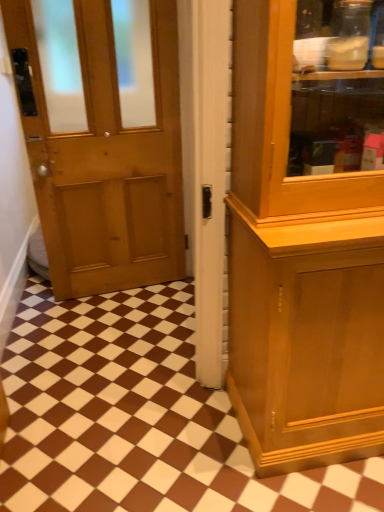
From the picture: Measure the distance between brown glossy tile at center and camera.

brown glossy tile at center is 4.18 feet from camera.

This screenshot has height=512, width=384. What are the coordinates of `brown glossy tile at center` in the screenshot? It's located at (137, 417).

What do you see at coordinates (137, 417) in the screenshot? I see `brown glossy tile at center` at bounding box center [137, 417].

In order to face matte wood door at center, should I rotate leftwards or rightwards?

Rotate left and turn 14.282 degrees.

Image resolution: width=384 pixels, height=512 pixels. What do you see at coordinates (101, 139) in the screenshot?
I see `matte wood door at center` at bounding box center [101, 139].

Measure the distance between matte wood door at center and camera.

matte wood door at center is 6.12 feet away from camera.

Where is `matte wood door at center`? matte wood door at center is located at coordinates (101, 139).

Find the location of `brown glossy tile at center`. brown glossy tile at center is located at coordinates (137, 417).

Looking at this image, between brown glossy tile at center and matte wood door at center, which one appears on the left side from the viewer's perspective?

matte wood door at center is more to the left.

Between brown glossy tile at center and matte wood door at center, which one is positioned in front?

matte wood door at center is in front.

Is point (103, 377) closer or farther from the camera than point (121, 204)?

Point (103, 377) is positioned closer to the camera compared to point (121, 204).

From the image's perspective, does brown glossy tile at center appear lower than matte wood door at center?

Correct, brown glossy tile at center appears lower than matte wood door at center in the image.

From a real-world perspective, does brown glossy tile at center stand above matte wood door at center?

Incorrect, from a real-world perspective, brown glossy tile at center is lower than matte wood door at center.

Which of these two, brown glossy tile at center or matte wood door at center, is thinner?

matte wood door at center is thinner.

From their relative heights in the image, would you say brown glossy tile at center is taller or shorter than matte wood door at center?

Considering their sizes, brown glossy tile at center has less height than matte wood door at center.

Considering the relative sizes of brown glossy tile at center and matte wood door at center in the image provided, is brown glossy tile at center bigger than matte wood door at center?

Yes, brown glossy tile at center is bigger than matte wood door at center.

Is matte wood door at center inside brown glossy tile at center?

That's incorrect, matte wood door at center is not inside brown glossy tile at center.

Are brown glossy tile at center and matte wood door at center located far from each other?

brown glossy tile at center is near matte wood door at center, not far away.

Is brown glossy tile at center looking in the opposite direction of matte wood door at center?

No, brown glossy tile at center is not facing away from matte wood door at center.

How different are the orientations of brown glossy tile at center and matte wood door at center in degrees?

They differ by 0.345 degrees in their facing directions.

This screenshot has width=384, height=512. What are the coordinates of `door on the left of brown glossy tile at center` in the screenshot? It's located at (101, 139).

Consider the image. Which object is positioned more to the right, matte wood door at center or brown glossy tile at center?

A: brown glossy tile at center is more to the right.

Is matte wood door at center closer to the viewer compared to brown glossy tile at center?

Yes, the depth of matte wood door at center is less than that of brown glossy tile at center.

Is point (109, 144) farther from camera compared to point (4, 505)?

Yes, point (109, 144) is farther from viewer.

From the image's perspective, does matte wood door at center appear higher than brown glossy tile at center?

Yes.

From a real-world perspective, is matte wood door at center positioned above or below brown glossy tile at center?

matte wood door at center is above brown glossy tile at center.

Between matte wood door at center and brown glossy tile at center, which one has larger width?

brown glossy tile at center.

Between matte wood door at center and brown glossy tile at center, which one has more height?

With more height is matte wood door at center.

Is matte wood door at center bigger or smaller than brown glossy tile at center?

In the image, matte wood door at center appears to be smaller than brown glossy tile at center.

Is matte wood door at center not inside brown glossy tile at center?

That's correct, matte wood door at center is outside of brown glossy tile at center.

Are matte wood door at center and brown glossy tile at center far apart?

Actually, matte wood door at center and brown glossy tile at center are a little close together.

In the scene shown: Is matte wood door at center looking in the opposite direction of brown glossy tile at center?

Absolutely, matte wood door at center is directed away from brown glossy tile at center.

What's the angular difference between matte wood door at center and brown glossy tile at center's facing directions?

The angle between the facing direction of matte wood door at center and the facing direction of brown glossy tile at center is 0.345 degrees.

The width and height of the screenshot is (384, 512). I want to click on door in front of the brown glossy tile at center, so click(x=101, y=139).

Identify the location of door above the brown glossy tile at center (from the image's perspective). (101, 139).

You are a GUI agent. You are given a task and a screenshot of the screen. Output one action in this format:
    pyautogui.click(x=<x>, y=<y>)
    Task: Click on the door above the brown glossy tile at center (from a real-world perspective)
    
    Given the screenshot: What is the action you would take?
    pyautogui.click(x=101, y=139)